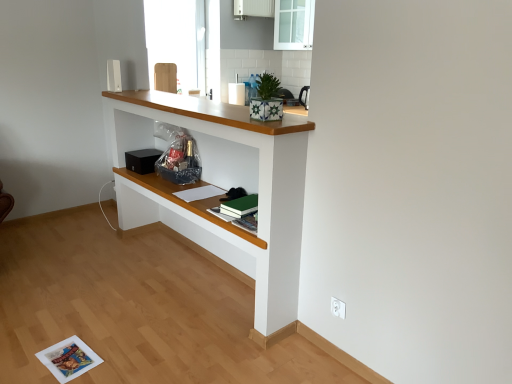
In the scene shown: Measure the distance between point (198, 237) and camera.

The depth of point (198, 237) is 10.11 feet.

The image size is (512, 384). Identify the location of white plastic electric outlet at lower right. (338, 308).

Can you tell me how much black matte speaker at center and white painted wood shelf at center differ in facing direction?

2.54 degrees.

Consider the image. Considering the positions of objects black matte speaker at center and white painted wood shelf at center in the image provided, who is more to the left, black matte speaker at center or white painted wood shelf at center?

Positioned to the left is black matte speaker at center.

Is black matte speaker at center beside white painted wood shelf at center?

No.

Is black matte speaker at center inside the boundaries of white painted wood shelf at center, or outside?

black matte speaker at center lies within the bounds of white painted wood shelf at center.

Is black matte speaker at center taller or shorter than transparent glass cabinet at upper center?

Considering their sizes, black matte speaker at center has less height than transparent glass cabinet at upper center.

I want to click on glass door that appears behind the black matte speaker at center, so click(294, 24).

Is black matte speaker at center facing towards transparent glass cabinet at upper center?

No, black matte speaker at center does not turn towards transparent glass cabinet at upper center.

Considering the relative sizes of black matte speaker at center and transparent glass cabinet at upper center in the image provided, is black matte speaker at center wider than transparent glass cabinet at upper center?

No, black matte speaker at center is not wider than transparent glass cabinet at upper center.

Between white glossy cabinet at upper center and white plastic electric outlet at lower right, which one is positioned behind?

white glossy cabinet at upper center is further away from the camera.

The width and height of the screenshot is (512, 384). I want to click on electric outlet on the right of white glossy cabinet at upper center, so click(338, 308).

Which point is more distant from viewer, (250, 4) or (344, 303)?

The point (250, 4) is more distant.

From the picture: From a real-world perspective, between black matte speaker at center and white plastic electric outlet at lower right, who is vertically lower?

From a 3D spatial view, white plastic electric outlet at lower right is below.

Does point (133, 170) appear closer or farther from the camera than point (335, 311)?

Point (133, 170) is positioned farther from the camera compared to point (335, 311).

Considering the relative sizes of black matte speaker at center and white plastic electric outlet at lower right in the image provided, is black matte speaker at center wider than white plastic electric outlet at lower right?

Yes, black matte speaker at center is wider than white plastic electric outlet at lower right.

Considering the positions of objects white painted wood shelf at center and white glossy cabinet at upper center in the image provided, who is behind, white painted wood shelf at center or white glossy cabinet at upper center?

white glossy cabinet at upper center is further from the camera.

Considering the points (241, 117) and (243, 5), which point is behind, point (241, 117) or point (243, 5)?

The point (243, 5) is farther.

Which of these two, white painted wood shelf at center or white glossy cabinet at upper center, stands shorter?

white glossy cabinet at upper center.

Between white painted wood shelf at center and white glossy cabinet at upper center, which one has smaller size?

white glossy cabinet at upper center is smaller.

From the image's perspective, which is above, white painted wood shelf at center or black matte speaker at center?

black matte speaker at center.

Considering the positions of point (295, 135) and point (128, 155), is point (295, 135) closer or farther from the camera than point (128, 155)?

Point (295, 135).

What's the angular difference between white painted wood shelf at center and black matte speaker at center's facing directions?

The angle between the facing direction of white painted wood shelf at center and the facing direction of black matte speaker at center is 2.54 degrees.

Which is more to the right, white painted wood shelf at center or black matte speaker at center?

Positioned to the right is white painted wood shelf at center.

From the image's perspective, is white plastic electric outlet at lower right located above white glossy cabinet at upper center?

Actually, white plastic electric outlet at lower right appears below white glossy cabinet at upper center in the image.

In the image, there is a white plastic electric outlet at lower right. Identify the location of cabinetry above it (from the image's perspective). (253, 8).

Considering the sizes of white plastic electric outlet at lower right and white glossy cabinet at upper center in the image, is white plastic electric outlet at lower right taller or shorter than white glossy cabinet at upper center?

Clearly, white plastic electric outlet at lower right is shorter compared to white glossy cabinet at upper center.

Based on the photo, is white plastic electric outlet at lower right next to white glossy cabinet at upper center?

No, white plastic electric outlet at lower right is not making contact with white glossy cabinet at upper center.

Identify the location of shelf lying on the right of black matte speaker at center. (217, 198).

Locate an element on the screen. The height and width of the screenshot is (384, 512). glass door that is behind the black matte speaker at center is located at coordinates (294, 24).

Considering their positions, is white plastic electric outlet at lower right positioned closer to white painted wood shelf at center than white glossy cabinet at upper center?

white plastic electric outlet at lower right is positioned closer to the anchor white painted wood shelf at center.

Looking at the image, which one is located closer to white painted wood shelf at center, white plastic electric outlet at lower right or black matte speaker at center?

black matte speaker at center is closer to white painted wood shelf at center.

When comparing their distances from white painted wood shelf at center, does white glossy cabinet at upper center or transparent glass cabinet at upper center seem closer?

Based on the image, transparent glass cabinet at upper center appears to be nearer to white painted wood shelf at center.

Looking at the image, which one is located further to white plastic electric outlet at lower right, white painted wood shelf at center or black matte speaker at center?

The object further to white plastic electric outlet at lower right is black matte speaker at center.

Estimate the real-world distances between objects in this image. Which object is further from black matte speaker at center, white glossy cabinet at upper center or transparent glass cabinet at upper center?

white glossy cabinet at upper center.

When comparing their distances from black matte speaker at center, does transparent glass cabinet at upper center or white plastic electric outlet at lower right seem further?

transparent glass cabinet at upper center.

From the picture: From the image, which object appears to be farther from white glossy cabinet at upper center, white plastic electric outlet at lower right or black matte speaker at center?

white plastic electric outlet at lower right.

Based on their spatial positions, is transparent glass cabinet at upper center or white glossy cabinet at upper center further from white painted wood shelf at center?

white glossy cabinet at upper center lies further to white painted wood shelf at center than the other object.

You are a GUI agent. You are given a task and a screenshot of the screen. Output one action in this format:
    pyautogui.click(x=<x>, y=<y>)
    Task: Click on the appliance between white glossy cabinet at upper center and white plastic electric outlet at lower right in the up-down direction
    This screenshot has width=512, height=384.
    Given the screenshot: What is the action you would take?
    pyautogui.click(x=142, y=160)

Identify the location of glass door between white glossy cabinet at upper center and black matte speaker at center vertically. (294, 24).

Where is `glass door between white painted wood shelf at center and white glossy cabinet at upper center in the front-back direction`? glass door between white painted wood shelf at center and white glossy cabinet at upper center in the front-back direction is located at coordinates (294, 24).

At what (x,y) coordinates should I click in order to perform the action: click on appliance between white painted wood shelf at center and white glossy cabinet at upper center in the front-back direction. Please return your answer as a coordinate pair (x, y). The image size is (512, 384). Looking at the image, I should click on (142, 160).